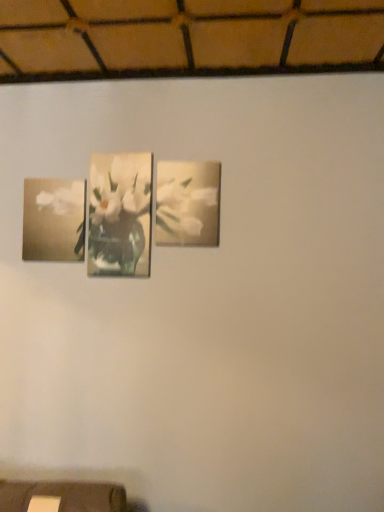
Question: Is the position of matte floral print at center, the first picture frame from the right, less distant than that of matte floral print at left, which is the 1th picture frame in left-to-right order?

Choices:
 (A) no
 (B) yes

Answer: (B)

Question: Is matte floral print at center, the first picture frame from the right, far away from matte floral print at left, placed as the 2th picture frame when sorted from right to left?

Choices:
 (A) no
 (B) yes

Answer: (A)

Question: Is matte floral print at center, the first picture frame from the right, shorter than matte floral print at left, which is the 1th picture frame in left-to-right order?

Choices:
 (A) no
 (B) yes

Answer: (A)

Question: Considering the relative sizes of matte floral print at center, which is the 2th picture frame from left to right, and matte floral print at left, placed as the 2th picture frame when sorted from right to left, in the image provided, is matte floral print at center, which is the 2th picture frame from left to right, taller than matte floral print at left, placed as the 2th picture frame when sorted from right to left,?

Choices:
 (A) yes
 (B) no

Answer: (A)

Question: Is matte floral print at center, the first picture frame from the right, positioned beyond the bounds of matte floral print at left, which is the 1th picture frame in left-to-right order?

Choices:
 (A) no
 (B) yes

Answer: (B)

Question: Considering the positions of point (99, 202) and point (39, 237), is point (99, 202) closer or farther from the camera than point (39, 237)?

Choices:
 (A) closer
 (B) farther

Answer: (A)

Question: Is matte floral print at center taller or shorter than matte floral print at left, which is the 1th picture frame in left-to-right order?

Choices:
 (A) tall
 (B) short

Answer: (A)

Question: In terms of size, does matte floral print at center appear bigger or smaller than matte floral print at left, placed as the 2th picture frame when sorted from right to left?

Choices:
 (A) big
 (B) small

Answer: (A)

Question: Is matte floral print at center inside the boundaries of matte floral print at left, which is the 1th picture frame in left-to-right order, or outside?

Choices:
 (A) inside
 (B) outside

Answer: (B)

Question: From the image's perspective, is matte floral print at center positioned above or below matte floral print at center, the first picture frame from the right?

Choices:
 (A) below
 (B) above

Answer: (A)

Question: Visually, is matte floral print at center positioned to the left or to the right of matte floral print at center, which is the 2th picture frame from left to right?

Choices:
 (A) left
 (B) right

Answer: (A)

Question: Is matte floral print at center situated inside matte floral print at center, which is the 2th picture frame from left to right, or outside?

Choices:
 (A) outside
 (B) inside

Answer: (A)

Question: In the image, is matte floral print at center positioned in front of or behind matte floral print at center, the first picture frame from the right?

Choices:
 (A) front
 (B) behind

Answer: (B)

Question: Is point (51, 245) closer or farther from the camera than point (190, 190)?

Choices:
 (A) closer
 (B) farther

Answer: (B)

Question: Looking at their shapes, would you say matte floral print at left, placed as the 2th picture frame when sorted from right to left, is wider or thinner than matte floral print at center, the first picture frame from the right?

Choices:
 (A) wide
 (B) thin

Answer: (A)